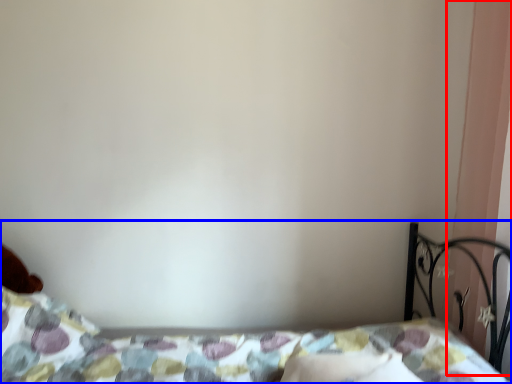
Question: Which of the following is the closest to the observer, curtain (highlighted by a red box) or bed (highlighted by a blue box)?

Choices:
 (A) curtain
 (B) bed

Answer: (B)